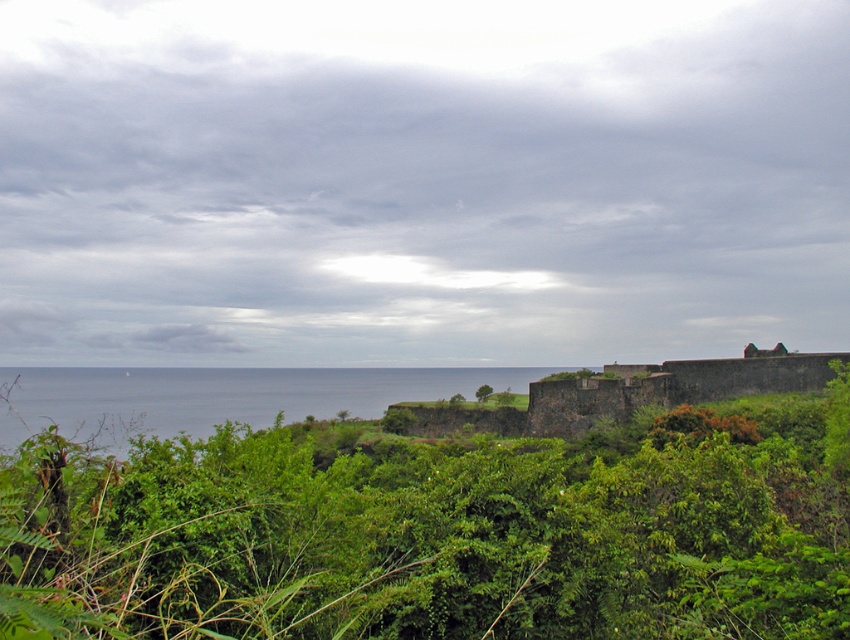
The width and height of the screenshot is (850, 640). Describe the element at coordinates (442, 528) in the screenshot. I see `green leafy shrubs at center` at that location.

I want to click on green leafy shrubs at center, so click(x=442, y=528).

Locate an element on the screen. The width and height of the screenshot is (850, 640). green leafy shrubs at center is located at coordinates (442, 528).

Is point (473, 374) farther from camera compared to point (488, 390)?

Yes, point (473, 374) is farther from viewer.

In order to click on blue water at center in this screenshot , I will do pyautogui.click(x=218, y=396).

Between point (374, 416) and point (479, 392), which one is positioned behind?

The point (374, 416) is more distant.

Where is `blue water at center`? The image size is (850, 640). blue water at center is located at coordinates (x=218, y=396).

Does green leafy shrubs at center have a larger size compared to blue water at center?

No, green leafy shrubs at center is not bigger than blue water at center.

Who is more distant from viewer, (216,534) or (4,420)?

Positioned behind is point (4,420).

At what (x,y) coordinates should I click in order to perform the action: click on green leafy shrubs at center. Please return your answer as a coordinate pair (x, y). Looking at the image, I should click on (442, 528).